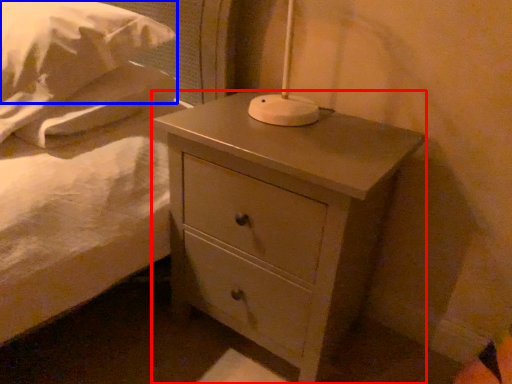
Question: Among these objects, which one is nearest to the camera, nightstand (highlighted by a red box) or pillow (highlighted by a blue box)?

Choices:
 (A) nightstand
 (B) pillow

Answer: (B)